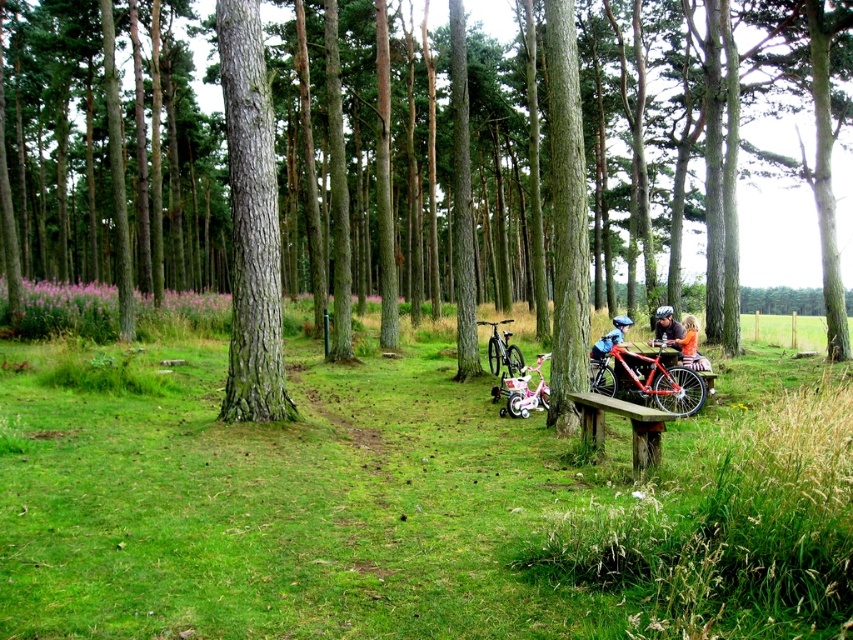
You are a hiker who wants to take a photo of both the shiny red mountain bike at right and the metallic silver bicycle at center. Which bike should you stand closer to in order to capture both in the frame?

To capture both the shiny red mountain bike at right and the metallic silver bicycle at center in the frame, you should stand closer to the metallic silver bicycle at center since the shiny red mountain bike at right is positioned to its right side, requiring a wider angle or closer proximity to the central bike to include both in the shot.

You are a hiker who wants to take a photo of both the shiny red mountain bike at right and the shiny silver mountain bike at center. Since you want both bikes in the frame, which bike should you focus on first to ensure both are in the photo?

You should focus on the shiny silver mountain bike at center first because the shiny red mountain bike at right is closer to the viewer. By focusing on the farther bike, you can ensure both bikes are in focus and within the frame.